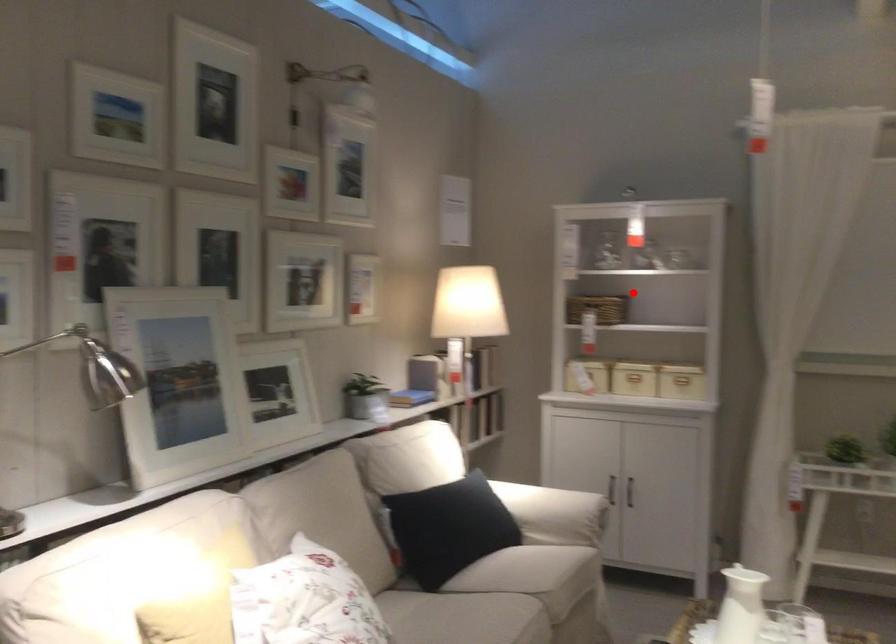
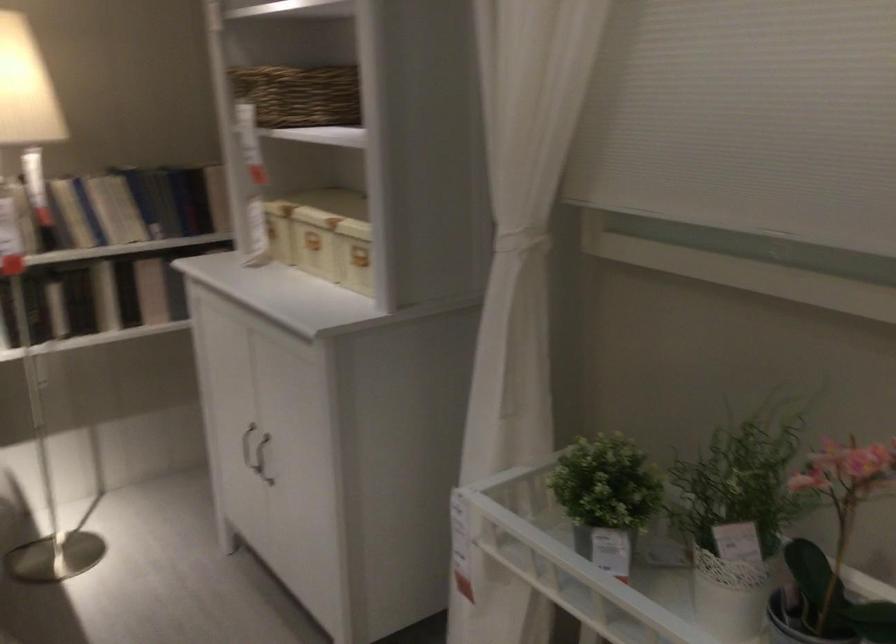
In the second image, find the point that corresponds to the highlighted location in the first image.

(298, 93)